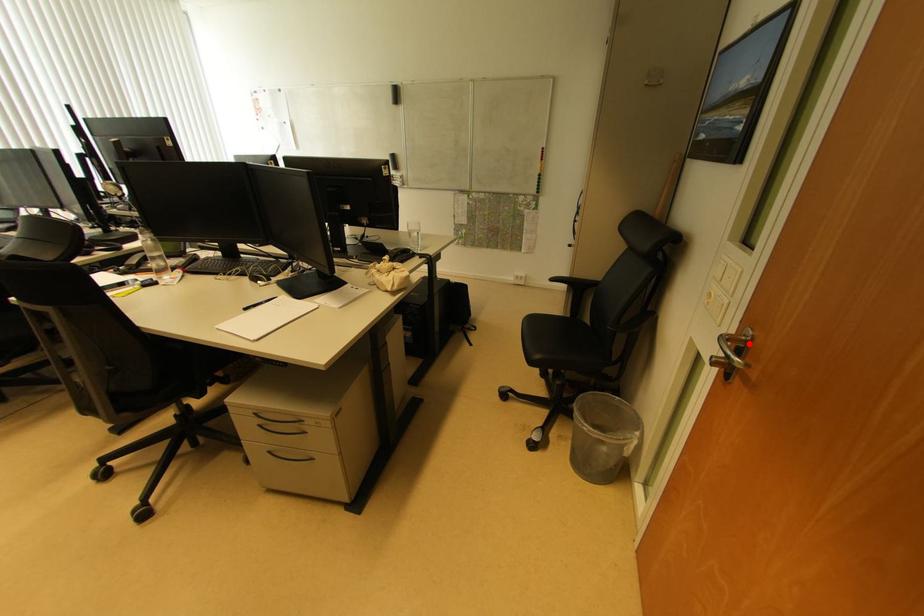
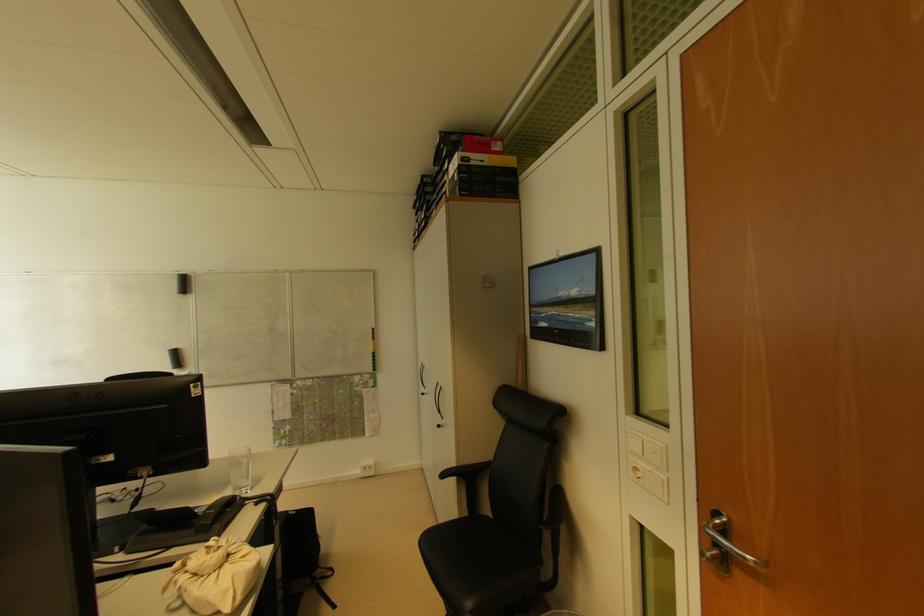
Where in the second image is the point corresponding to the highlighted location from the first image?

(726, 527)